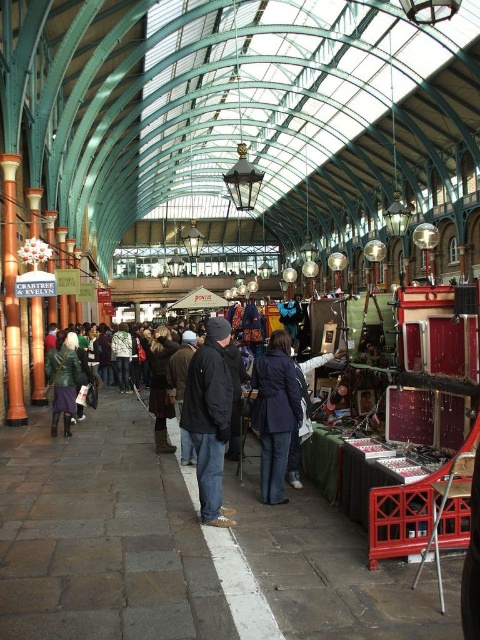
Question: Which point appears farthest from the camera in this image?

Choices:
 (A) (159, 371)
 (B) (68, 371)
 (C) (203, 442)

Answer: (B)

Question: Does black matte jacket at center appear on the right side of leather jacket at center?

Choices:
 (A) no
 (B) yes

Answer: (B)

Question: Which point is farther to the camera?

Choices:
 (A) green leather jacket at lower left
 (B) navy blue fabric coat at center
 (C) dark blue jacket at center
 (D) leather jacket at center

Answer: (A)

Question: Which point appears closest to the camera in this image?

Choices:
 (A) (147, 358)
 (B) (60, 371)
 (C) (274, 422)

Answer: (C)

Question: Does navy blue fabric coat at center have a lesser width compared to leather jacket at center?

Choices:
 (A) no
 (B) yes

Answer: (B)

Question: Does leather jacket at center have a larger size compared to green leather jacket at lower left?

Choices:
 (A) no
 (B) yes

Answer: (B)